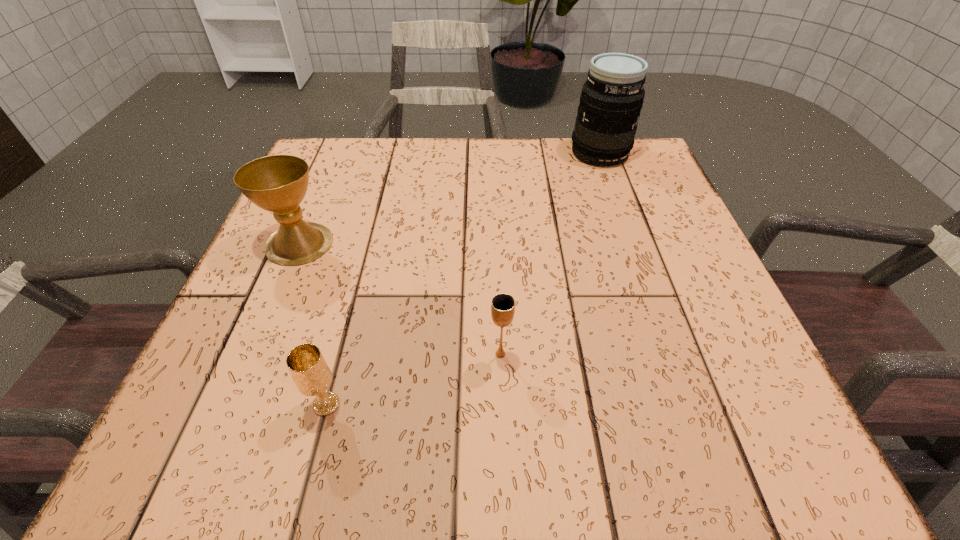
Locate an element on the screen. The height and width of the screenshot is (540, 960). free location at the right edge is located at coordinates (679, 316).

The height and width of the screenshot is (540, 960). What are the coordinates of `vacant space at the far left corner of the desktop` in the screenshot? It's located at (362, 170).

You are a GUI agent. You are given a task and a screenshot of the screen. Output one action in this format:
    pyautogui.click(x=<x>, y=<y>)
    Task: Click on the blank space at the near left corner of the desktop
    
    Given the screenshot: What is the action you would take?
    pyautogui.click(x=253, y=434)

You are a GUI agent. You are given a task and a screenshot of the screen. Output one action in this format:
    pyautogui.click(x=<x>, y=<y>)
    Task: Click on the free region at the far right corner
    This screenshot has width=960, height=540.
    Given the screenshot: What is the action you would take?
    pyautogui.click(x=645, y=160)

Locate an element on the screen. This screenshot has height=540, width=960. vacant space at the near right corner of the desktop is located at coordinates (747, 421).

The width and height of the screenshot is (960, 540). I want to click on free area in between the farthest object and the second chalice from left to right, so click(463, 278).

What are the coordinates of `free spot between the tallest object and the third shortest object` in the screenshot? It's located at (449, 198).

Identify the location of free space that is in between the leftmost object and the telephoto lens. The height and width of the screenshot is (540, 960). (449, 198).

This screenshot has width=960, height=540. In order to click on vacant area that lies between the second nearest chalice and the second farthest object in this screenshot , I will do `click(399, 299)`.

The image size is (960, 540). I want to click on vacant point located between the second farthest object and the farthest object, so click(x=449, y=198).